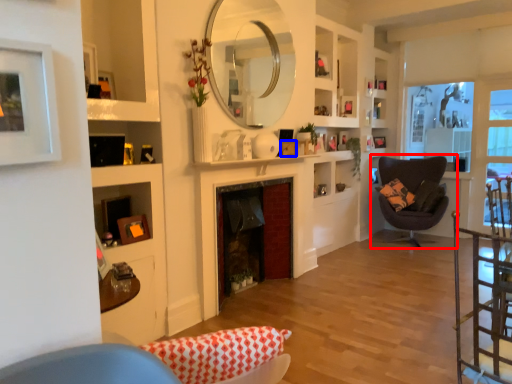
Question: Which of the following is the closest to the observer, chair (highlighted by a red box) or picture frame (highlighted by a blue box)?

Choices:
 (A) chair
 (B) picture frame

Answer: (B)